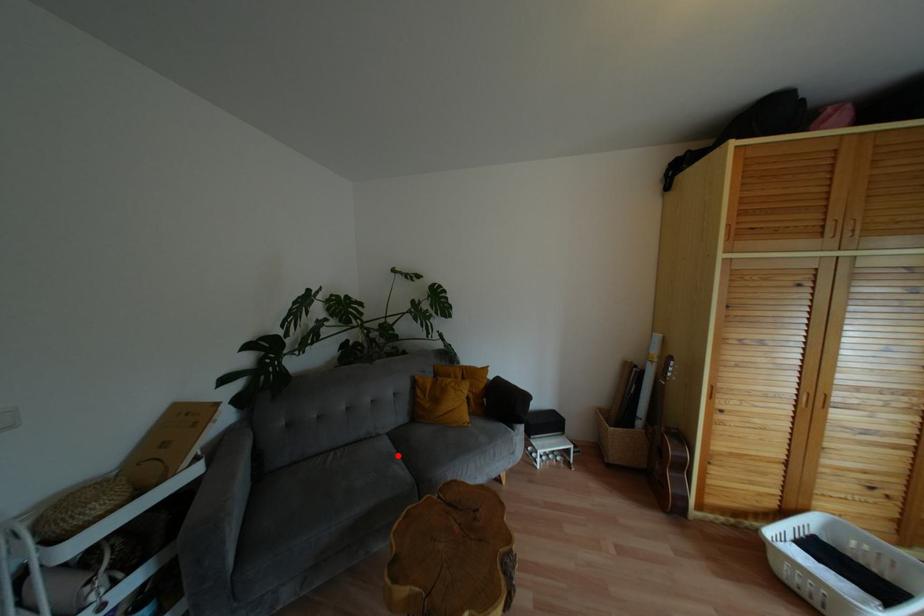
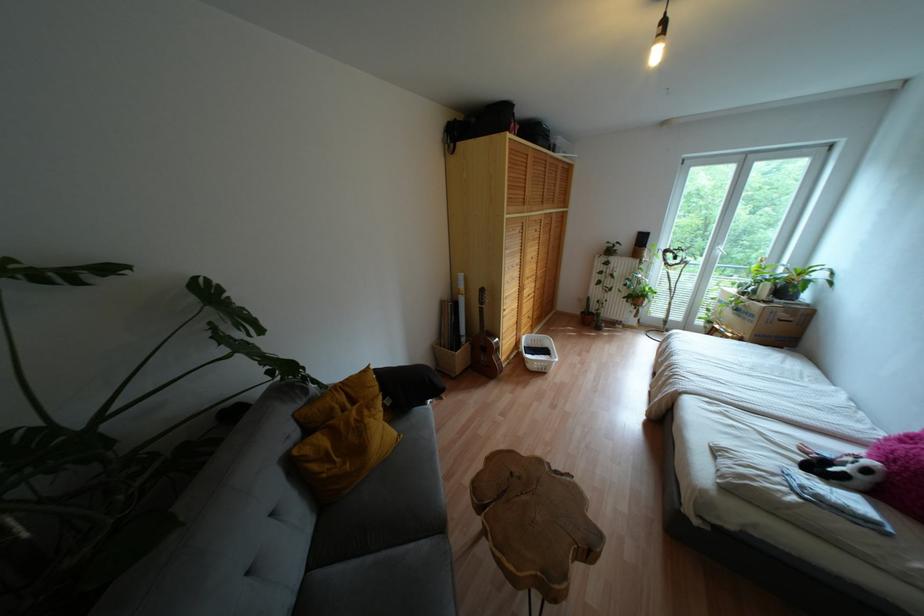
Find the pixel in the second image that matches the highlighted location in the first image.

(383, 553)